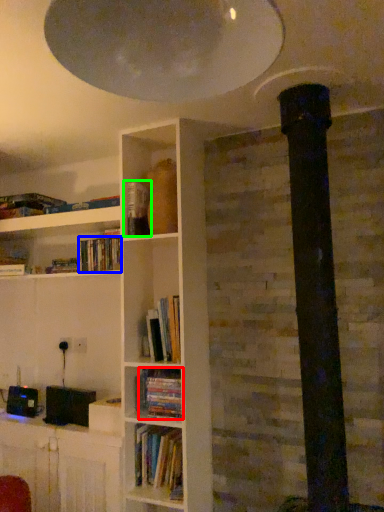
Question: Which is nearer to the book (highlighted by a red box)? book (highlighted by a blue box) or paperback book (highlighted by a green box).

Choices:
 (A) book
 (B) paperback book

Answer: (A)